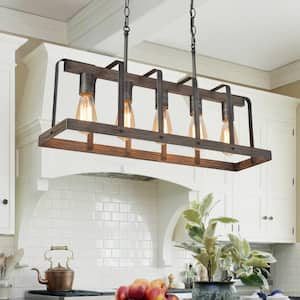
This screenshot has height=300, width=300. What are the coordinates of `rightmost cabinet` in the screenshot? It's located at (292, 211).